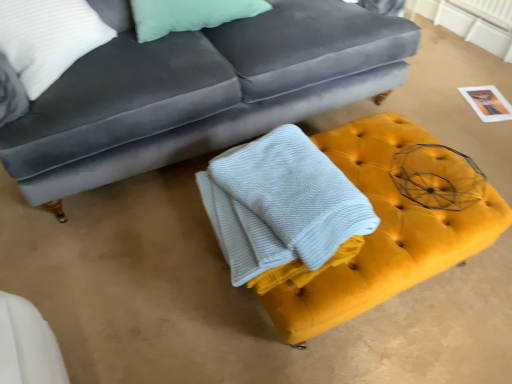
Question: Is velvet gray couch at upper center not inside yellow velvet ottoman at center?

Choices:
 (A) no
 (B) yes

Answer: (B)

Question: From a real-world perspective, is velvet gray couch at upper center beneath yellow velvet ottoman at center?

Choices:
 (A) yes
 (B) no

Answer: (B)

Question: Does velvet gray couch at upper center have a lesser height compared to yellow velvet ottoman at center?

Choices:
 (A) yes
 (B) no

Answer: (B)

Question: Does velvet gray couch at upper center have a lesser width compared to yellow velvet ottoman at center?

Choices:
 (A) no
 (B) yes

Answer: (A)

Question: Is there a large distance between velvet gray couch at upper center and yellow velvet ottoman at center?

Choices:
 (A) no
 (B) yes

Answer: (A)

Question: Is white textured bath towel at center wider or thinner than velvet gray couch at upper center?

Choices:
 (A) thin
 (B) wide

Answer: (A)

Question: From their relative heights in the image, would you say white textured bath towel at center is taller or shorter than velvet gray couch at upper center?

Choices:
 (A) short
 (B) tall

Answer: (A)

Question: Is white textured bath towel at center bigger or smaller than velvet gray couch at upper center?

Choices:
 (A) big
 (B) small

Answer: (B)

Question: Based on their positions, is white textured bath towel at center located to the left or right of velvet gray couch at upper center?

Choices:
 (A) left
 (B) right

Answer: (B)

Question: From the image's perspective, is white textured pillow at upper left positioned above or below white textured bath towel at center?

Choices:
 (A) below
 (B) above

Answer: (B)

Question: From a real-world perspective, is white textured pillow at upper left above or below white textured bath towel at center?

Choices:
 (A) below
 (B) above

Answer: (B)

Question: Is white textured pillow at upper left wider or thinner than white textured bath towel at center?

Choices:
 (A) thin
 (B) wide

Answer: (A)

Question: Visually, is white textured pillow at upper left positioned to the left or to the right of white textured bath towel at center?

Choices:
 (A) left
 (B) right

Answer: (A)

Question: From a real-world perspective, is velvet gray couch at upper center positioned above or below white textured bath towel at center?

Choices:
 (A) below
 (B) above

Answer: (B)

Question: Considering their positions, is velvet gray couch at upper center located in front of or behind white textured bath towel at center?

Choices:
 (A) front
 (B) behind

Answer: (B)